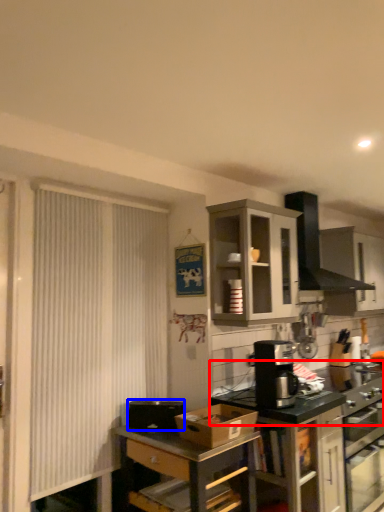
Question: Which object appears farthest to the camera in this image, countertop (highlighted by a red box) or appliance (highlighted by a blue box)?

Choices:
 (A) countertop
 (B) appliance

Answer: (A)